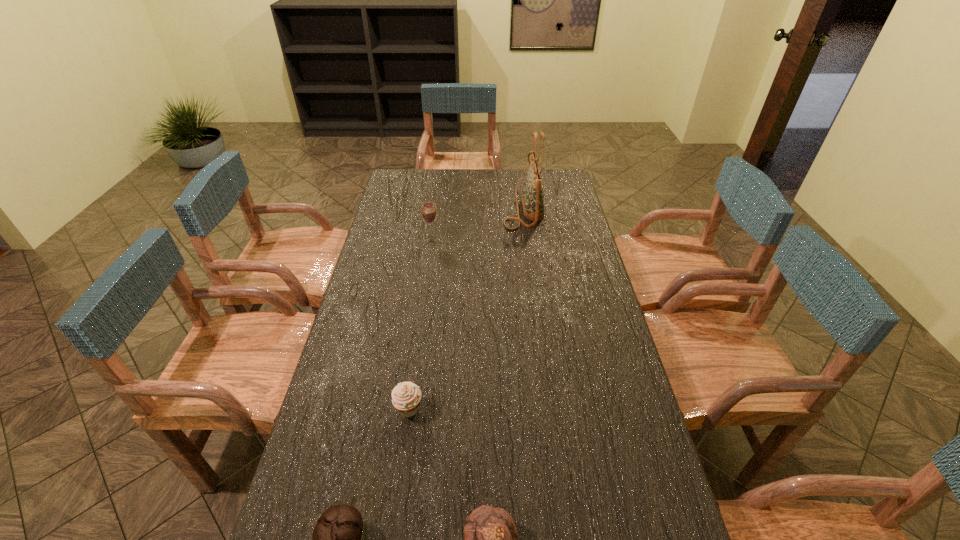
Find the location of a particular element. This screenshot has width=960, height=540. handbag is located at coordinates (533, 197).

Image resolution: width=960 pixels, height=540 pixels. Identify the location of the tallest object. (533, 197).

Where is `the fourth nearest object`? The image size is (960, 540). the fourth nearest object is located at coordinates (429, 214).

This screenshot has width=960, height=540. What are the coordinates of `wineglass` in the screenshot? It's located at (429, 214).

Where is `the third nearest object`? the third nearest object is located at coordinates (406, 396).

Identify the location of the farthest muffin. Image resolution: width=960 pixels, height=540 pixels. [406, 396].

Where is `vacant space located 0.110m on the front-facing side of the handbag`? vacant space located 0.110m on the front-facing side of the handbag is located at coordinates [x=478, y=207].

This screenshot has width=960, height=540. I want to click on free space located 0.070m on the front-facing side of the handbag, so click(487, 207).

Find the location of a particular element. free space located on the front-facing side of the handbag is located at coordinates (434, 207).

At what (x,y) coordinates should I click in order to perform the action: click on vacant space located 0.120m on the left of the second farthest object. Please return your answer as a coordinate pair (x, y). Looking at the image, I should click on (394, 240).